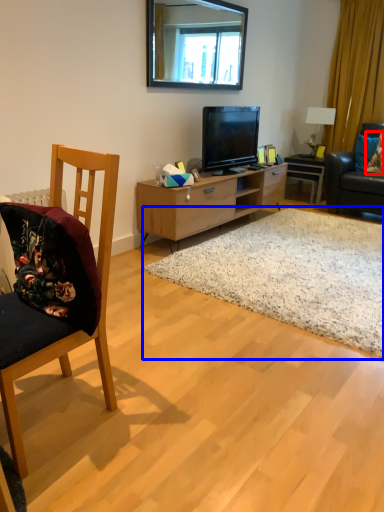
Question: Which point is closer to the camera, pillow (highlighted by a red box) or plain (highlighted by a blue box)?

Choices:
 (A) pillow
 (B) plain

Answer: (B)